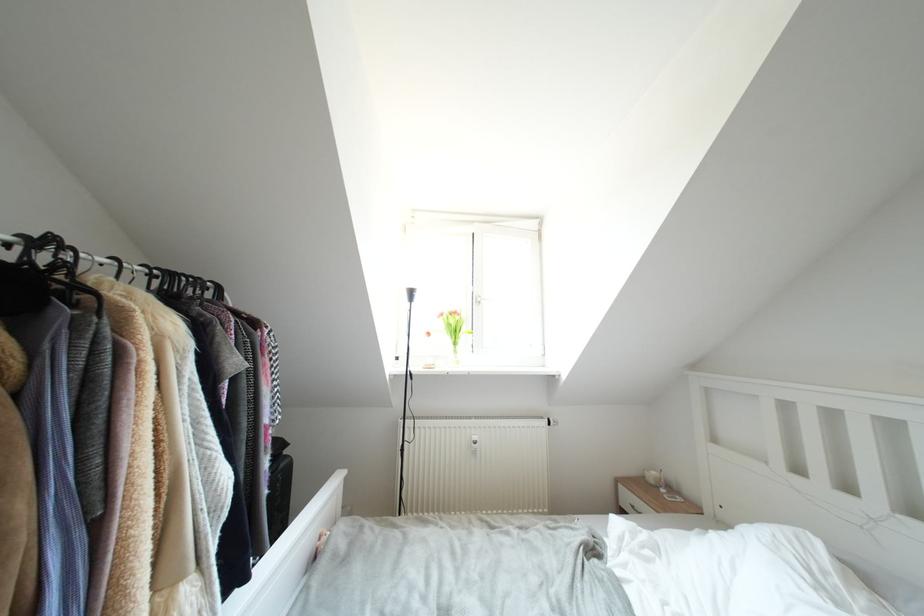
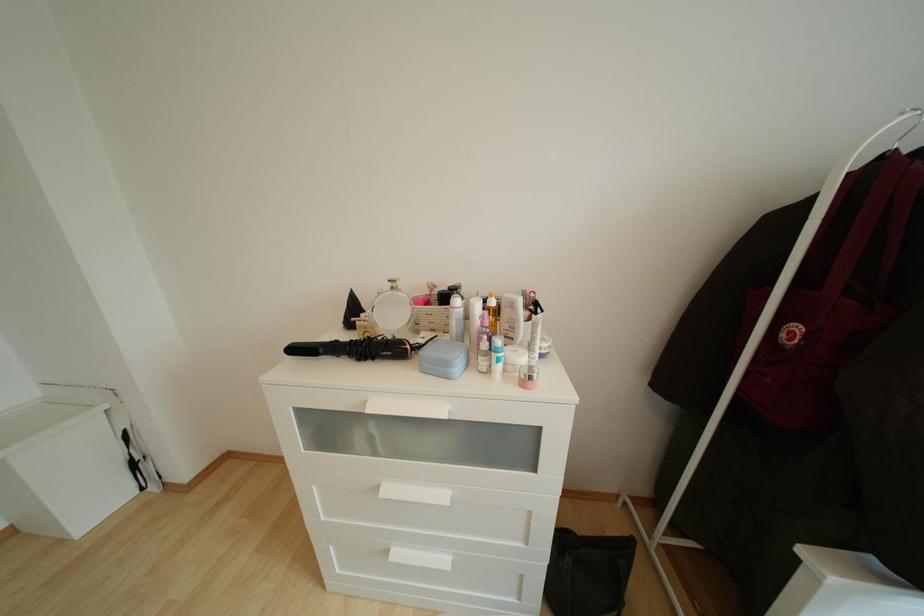
From the picture: The images are taken continuously from a first-person perspective. In which direction is your viewpoint rotating?

The rotation direction of the camera is left-down.